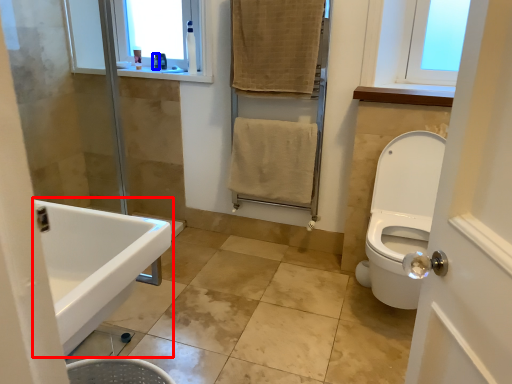
Question: Which point is further to the camera, sink (highlighted by a red box) or toiletry (highlighted by a blue box)?

Choices:
 (A) sink
 (B) toiletry

Answer: (B)